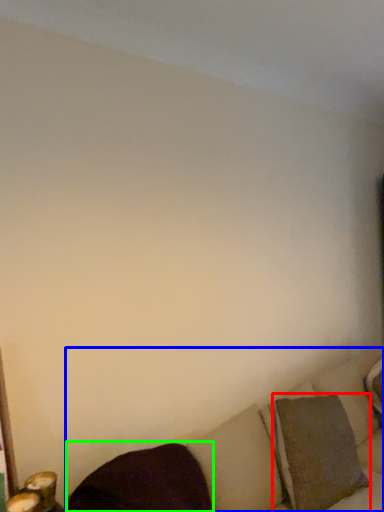
Question: Which object is the closest to the pillow (highlighted by a red box)? Choose among these: studio couch (highlighted by a blue box) or pillow (highlighted by a green box).

Choices:
 (A) studio couch
 (B) pillow

Answer: (A)